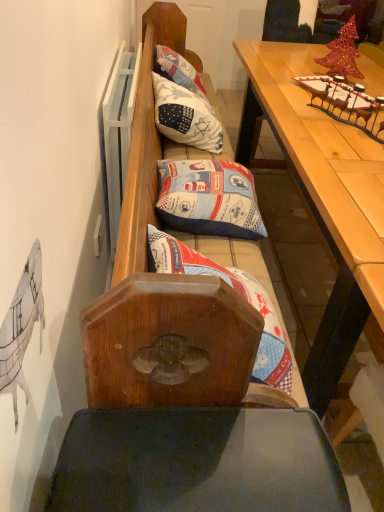
Question: Is wooden table at upper right thinner than white fabric pillow at center, the first pillow viewed from the back?

Choices:
 (A) yes
 (B) no

Answer: (B)

Question: Can we say wooden table at upper right lies outside white fabric pillow at center, the 3th pillow ordered from the bottom?

Choices:
 (A) no
 (B) yes

Answer: (B)

Question: Is wooden table at upper right at the right side of white fabric pillow at center, positioned as the third pillow in front-to-back order?

Choices:
 (A) no
 (B) yes

Answer: (B)

Question: Are wooden table at upper right and white fabric pillow at center, the 3th pillow ordered from the bottom, making contact?

Choices:
 (A) yes
 (B) no

Answer: (B)

Question: Is wooden table at upper right at the left side of white fabric pillow at center, the first pillow viewed from the back?

Choices:
 (A) no
 (B) yes

Answer: (A)

Question: In the image, is blue fabric pillow at center, placed as the 2th pillow when sorted from bottom to top, positioned in front of or behind printed fabric pillow at center, which appears as the 3th pillow when viewed from the back?

Choices:
 (A) front
 (B) behind

Answer: (B)

Question: Looking at the image, does blue fabric pillow at center, which appears as the second pillow when viewed from the front, seem bigger or smaller compared to printed fabric pillow at center, which appears as the 3th pillow when viewed from the back?

Choices:
 (A) small
 (B) big

Answer: (A)

Question: Based on their positions, is blue fabric pillow at center, placed as the 2th pillow when sorted from bottom to top, located to the left or right of printed fabric pillow at center, which appears as the 3th pillow when viewed from the back?

Choices:
 (A) left
 (B) right

Answer: (A)

Question: From the image's perspective, is blue fabric pillow at center, which is the second pillow in back-to-front order, located above or below printed fabric pillow at center, which is counted as the 1th pillow, starting from the front?

Choices:
 (A) below
 (B) above

Answer: (B)

Question: In terms of height, does blue fabric pillow at center, which is the second pillow in back-to-front order, look taller or shorter compared to white fabric pillow at center, the 3th pillow ordered from the bottom?

Choices:
 (A) short
 (B) tall

Answer: (A)

Question: Based on their positions, is blue fabric pillow at center, the second pillow when ordered from top to bottom, located to the left or right of white fabric pillow at center, the 3th pillow ordered from the bottom?

Choices:
 (A) right
 (B) left

Answer: (A)

Question: From a real-world perspective, is blue fabric pillow at center, placed as the 2th pillow when sorted from bottom to top, positioned above or below white fabric pillow at center, the 3th pillow ordered from the bottom?

Choices:
 (A) below
 (B) above

Answer: (A)

Question: Is blue fabric pillow at center, placed as the 2th pillow when sorted from bottom to top, wider or thinner than white fabric pillow at center, the first pillow viewed from the back?

Choices:
 (A) thin
 (B) wide

Answer: (B)

Question: Is white fabric pillow at center, the 1th pillow from the top, in front of or behind printed fabric pillow at center, arranged as the 3th pillow when viewed from the top, in the image?

Choices:
 (A) behind
 (B) front

Answer: (A)

Question: From the image's perspective, is white fabric pillow at center, the 1th pillow from the top, above or below printed fabric pillow at center, which is the 1th pillow from bottom to top?

Choices:
 (A) above
 (B) below

Answer: (A)